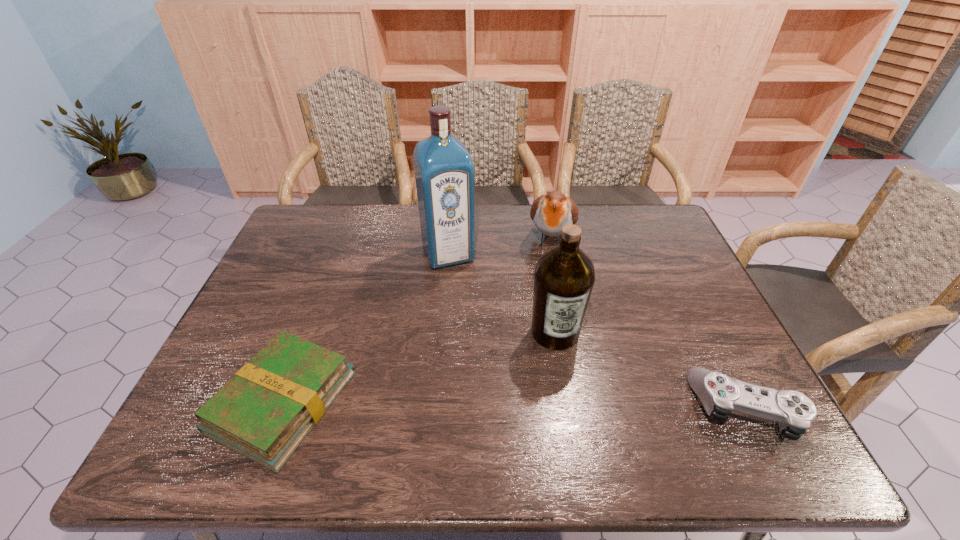
Identify the location of unoccupied area between the book and the bird. pyautogui.click(x=417, y=321).

At what (x,y) coordinates should I click in order to perform the action: click on free area in between the fourth object from right to left and the book. Please return your answer as a coordinate pair (x, y). The height and width of the screenshot is (540, 960). Looking at the image, I should click on (366, 328).

At what (x,y) coordinates should I click in order to perform the action: click on free spot between the liquor and the rightmost object. Please return your answer as a coordinate pair (x, y). This screenshot has height=540, width=960. Looking at the image, I should click on (597, 331).

Image resolution: width=960 pixels, height=540 pixels. I want to click on free area in between the second object from left to right and the olive oil, so click(x=501, y=293).

Find the location of a particular element. free space between the leftmost object and the third shortest object is located at coordinates (417, 321).

Find the location of a particular element. This screenshot has width=960, height=540. the fourth closest object to the olive oil is located at coordinates (264, 412).

What are the coordinates of `the fourth closest object to the book` in the screenshot? It's located at (720, 394).